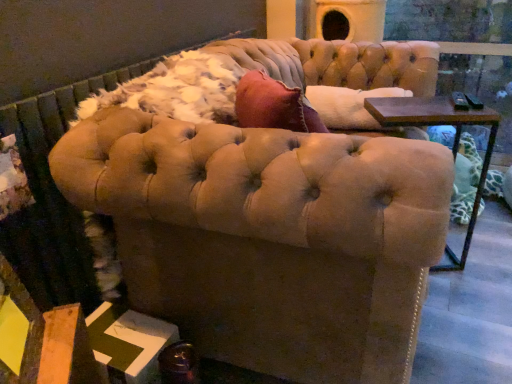
Question: From a real-world perspective, is transparent glass door at upper right on top of suede beige chair at center?

Choices:
 (A) yes
 (B) no

Answer: (A)

Question: Considering the relative sizes of transparent glass door at upper right and suede beige chair at center in the image provided, is transparent glass door at upper right wider than suede beige chair at center?

Choices:
 (A) yes
 (B) no

Answer: (B)

Question: Does transparent glass door at upper right appear on the right side of suede beige chair at center?

Choices:
 (A) yes
 (B) no

Answer: (A)

Question: Is transparent glass door at upper right turned away from suede beige chair at center?

Choices:
 (A) no
 (B) yes

Answer: (A)

Question: Can you confirm if transparent glass door at upper right is smaller than suede beige chair at center?

Choices:
 (A) no
 (B) yes

Answer: (B)

Question: Could you tell me if transparent glass door at upper right is turned towards suede beige chair at center?

Choices:
 (A) no
 (B) yes

Answer: (B)

Question: Can you confirm if suede beige chair at center is thinner than transparent glass door at upper right?

Choices:
 (A) no
 (B) yes

Answer: (A)

Question: Is suede beige chair at center to the right of transparent glass door at upper right from the viewer's perspective?

Choices:
 (A) no
 (B) yes

Answer: (A)

Question: Can you confirm if suede beige chair at center is wider than transparent glass door at upper right?

Choices:
 (A) yes
 (B) no

Answer: (A)

Question: Is suede beige chair at center next to transparent glass door at upper right and touching it?

Choices:
 (A) yes
 (B) no

Answer: (B)

Question: Is suede beige chair at center completely or partially outside of transparent glass door at upper right?

Choices:
 (A) yes
 (B) no

Answer: (A)

Question: From the image's perspective, is suede beige chair at center under transparent glass door at upper right?

Choices:
 (A) no
 (B) yes

Answer: (B)

Question: In the image, is transparent glass door at upper right positioned in front of or behind suede beige chair at center?

Choices:
 (A) front
 (B) behind

Answer: (B)